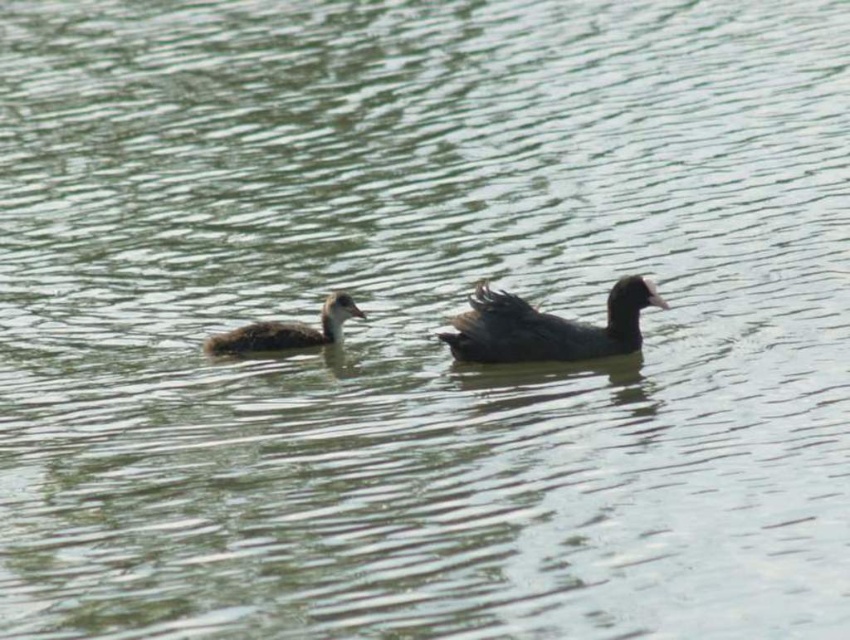
Question: Does black matte duck at center appear on the right side of brown matte duckling at center?

Choices:
 (A) yes
 (B) no

Answer: (A)

Question: Does black matte duck at center have a larger size compared to brown matte duckling at center?

Choices:
 (A) no
 (B) yes

Answer: (B)

Question: Can you confirm if black matte duck at center is positioned below brown matte duckling at center?

Choices:
 (A) no
 (B) yes

Answer: (A)